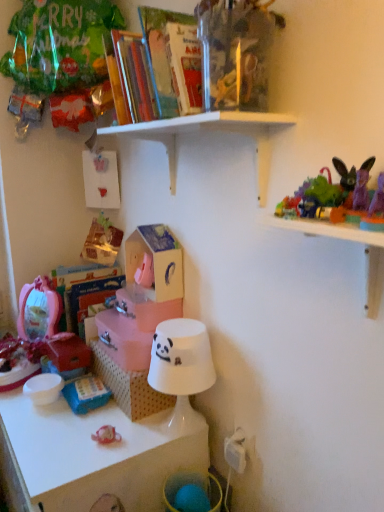
Locate an element on the screen. vacant space in front of blue plastic toy at lower left, which appears as the 1th toy when ordered from the bottom is located at coordinates [x=61, y=437].